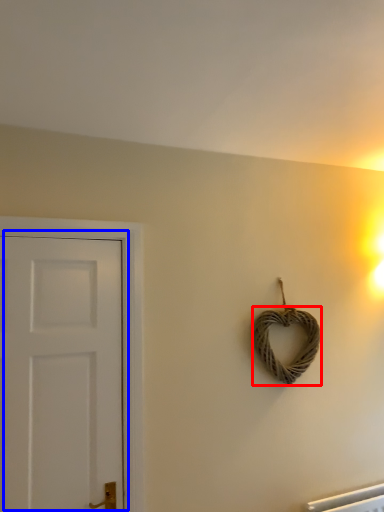
Question: Which object appears closest to the camera in this image, rope (highlighted by a red box) or door (highlighted by a blue box)?

Choices:
 (A) rope
 (B) door

Answer: (B)